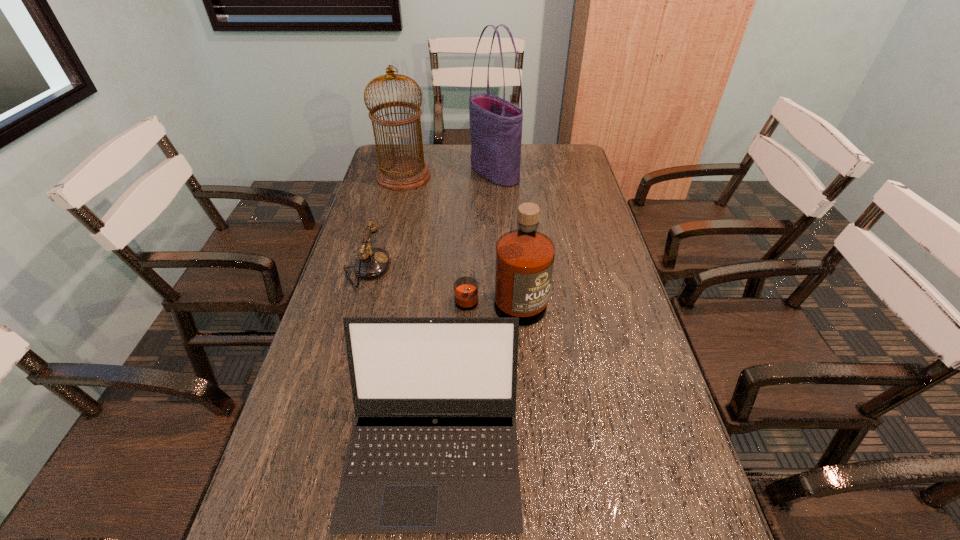
Identify the location of free space between the birdcage and the third tallest object. The height and width of the screenshot is (540, 960). (452, 241).

Image resolution: width=960 pixels, height=540 pixels. What are the coordinates of `free space between the tallest object and the nearest object` in the screenshot? It's located at (464, 312).

Image resolution: width=960 pixels, height=540 pixels. In order to click on free spot between the shortest object and the fourth shortest object in this screenshot , I will do `click(385, 222)`.

Find the location of a particular element. This screenshot has width=960, height=540. empty space between the liquor and the tallest object is located at coordinates (497, 240).

You are a GUI agent. You are given a task and a screenshot of the screen. Output one action in this format:
    pyautogui.click(x=<x>, y=<y>)
    Task: Click on the free space between the birdcage and the liquor
    The image size is (960, 540).
    Given the screenshot: What is the action you would take?
    pyautogui.click(x=452, y=241)

Find the location of a particular element. Image resolution: width=960 pixels, height=540 pixels. free area in between the telephone and the fourth shortest object is located at coordinates (385, 222).

The width and height of the screenshot is (960, 540). What are the coordinates of `object that stands as the closest to the fourth shortest object` in the screenshot? It's located at (495, 124).

Image resolution: width=960 pixels, height=540 pixels. I want to click on object that stands as the closest to the tallest object, so click(x=401, y=173).

Locate an element on the screen. This screenshot has height=540, width=960. free location that satisfies the following two spatial constraints: 1. on the front side of the tote bag; 2. on the front-facing side of the birdcage is located at coordinates (494, 176).